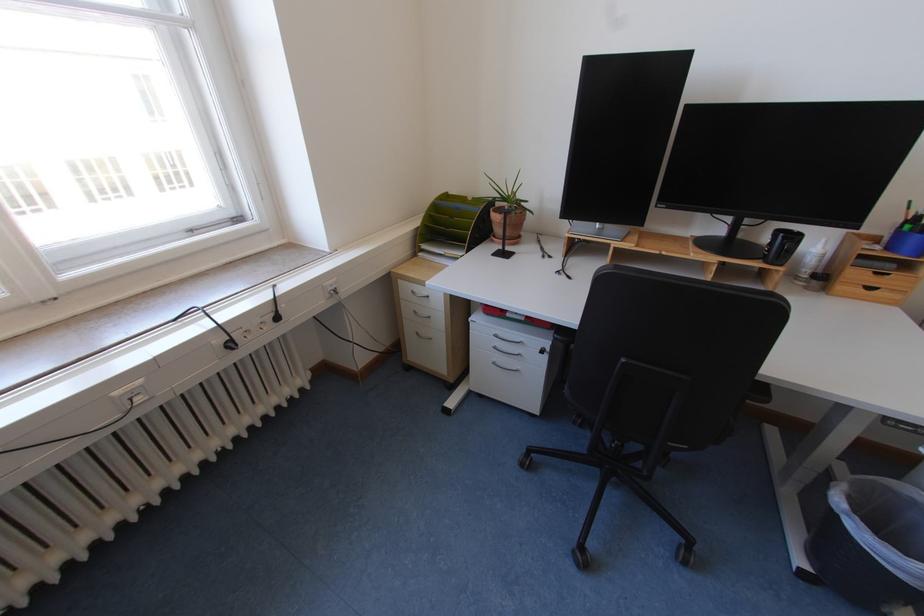
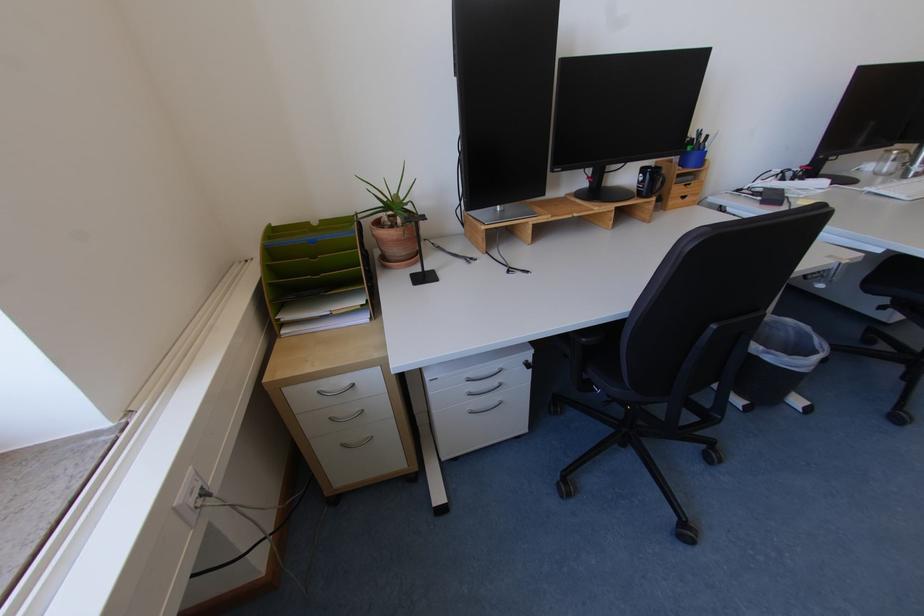
The point at (422, 310) is marked in the first image. Where is the corresponding point in the second image?

(337, 416)